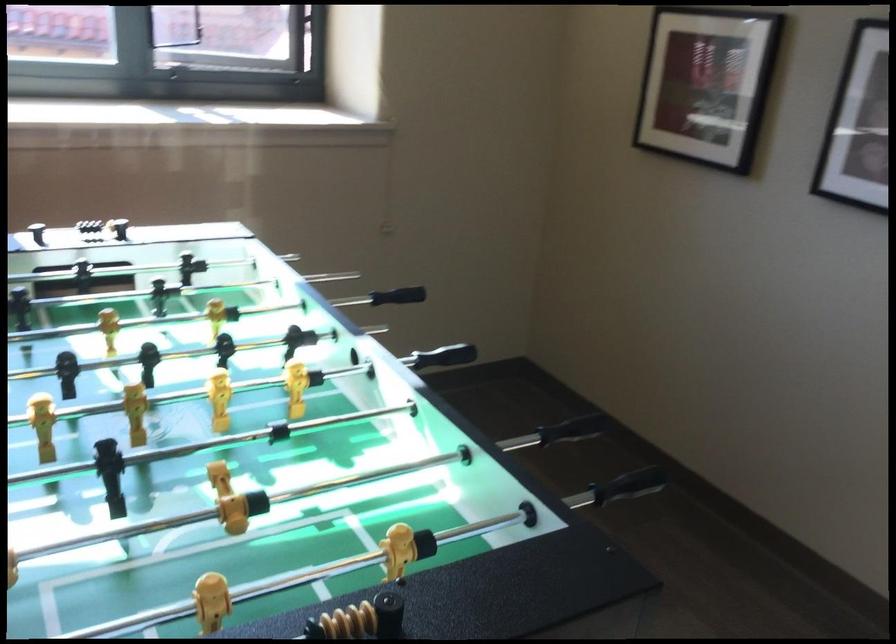
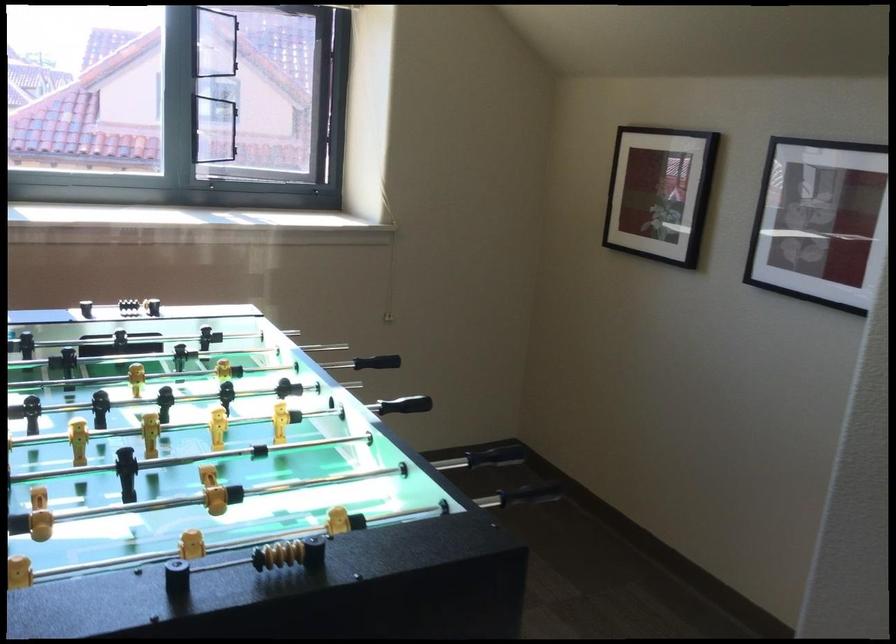
Locate, in the second image, the point that corresponds to the point at 375,281 in the first image.

(376, 362)